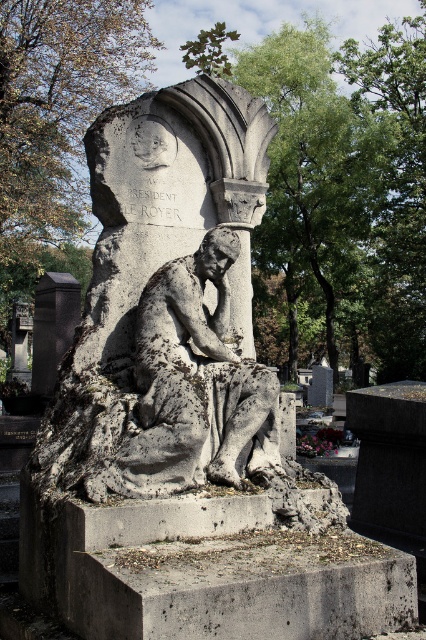
You are standing at the base of the weathered stone monument in the cemetery. You notice two points marked on the monument. The first point is at coordinates point (215, 170) and the second is at point (77, 312). If you were to walk directly toward the monument, which point would you encounter first?

Point (215, 170) is in front of point (77, 312), so you would encounter point (215, 170) first as you walk toward the monument.

You are a maintenance worker assigned to clean the gray stone statue at center and the black stone pillar at lower left. You have a 10 meter long hose. Can you reach both objects with the same hose without moving it? Explain your reasoning.

The gray stone statue at center and the black stone pillar at lower left are 9.11 meters apart. Since the hose is 10 meters long, which is longer than the distance between them, you can reach both objects with the same hose without moving it.

You are a tour guide leading a group to the gray stone statue at center. The group is currently standing at the entrance of the cemetery, which is 4 meters away from the statue. Can you safely walk towards the statue without any obstacles?

The distance between the entrance and the gray stone statue at center is 4.41 meters, so yes, you can safely walk towards the statue as the distance is sufficient and there are no mentioned obstacles.